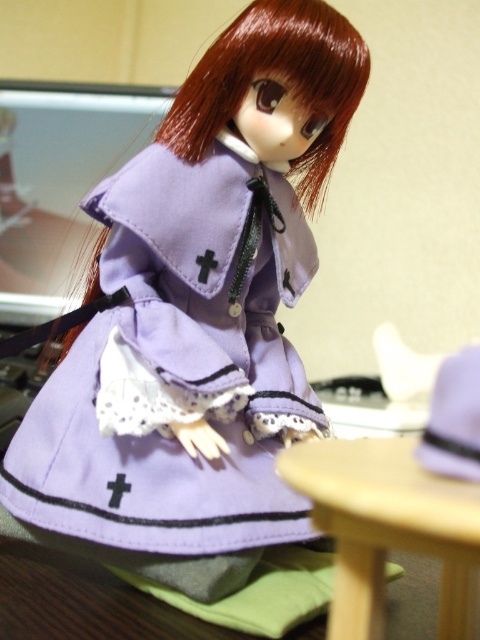
Question: Can you confirm if lavender fabric dress at center is positioned above shiny red hair at center?

Choices:
 (A) no
 (B) yes

Answer: (A)

Question: Which of the following is the farthest from the observer?

Choices:
 (A) (396, 534)
 (B) (466, 444)
 (C) (265, 152)

Answer: (C)

Question: Is lavender fabric dress at center further to camera compared to light wood table at lower right?

Choices:
 (A) no
 (B) yes

Answer: (B)

Question: Which is nearer to the lavender fabric dress at center?

Choices:
 (A) shiny red hair at center
 (B) light wood table at lower right

Answer: (A)

Question: Which object appears closest to the camera in this image?

Choices:
 (A) purple fabric hat at right
 (B) shiny red hair at center
 (C) lavender fabric dress at center

Answer: (A)

Question: From the image, what is the correct spatial relationship of light wood table at lower right in relation to purple fabric hat at right?

Choices:
 (A) above
 (B) below

Answer: (B)